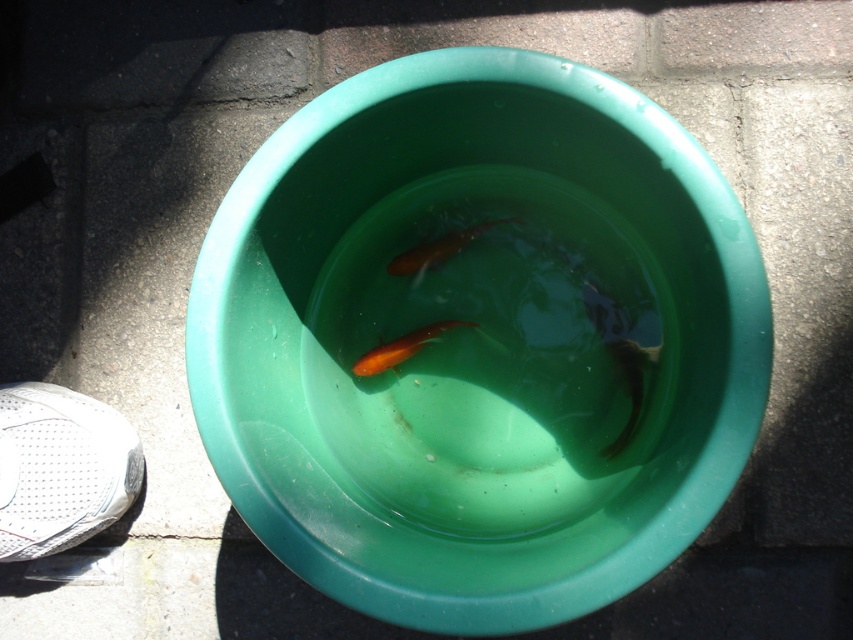
You are standing at point 0.5, 0.5 in the image. You want to reach the green plastic bowl at center. Which direction should you move in to get there?

You should move northeast to reach the green plastic bowl at center located at point [479,340] from your current position at [426,320].

You are a child who wants to catch the orange glossy fish at center and the orange glossy goldfish at center in the basin. Which one is taller?

The orange glossy fish at center is taller than the orange glossy goldfish at center.